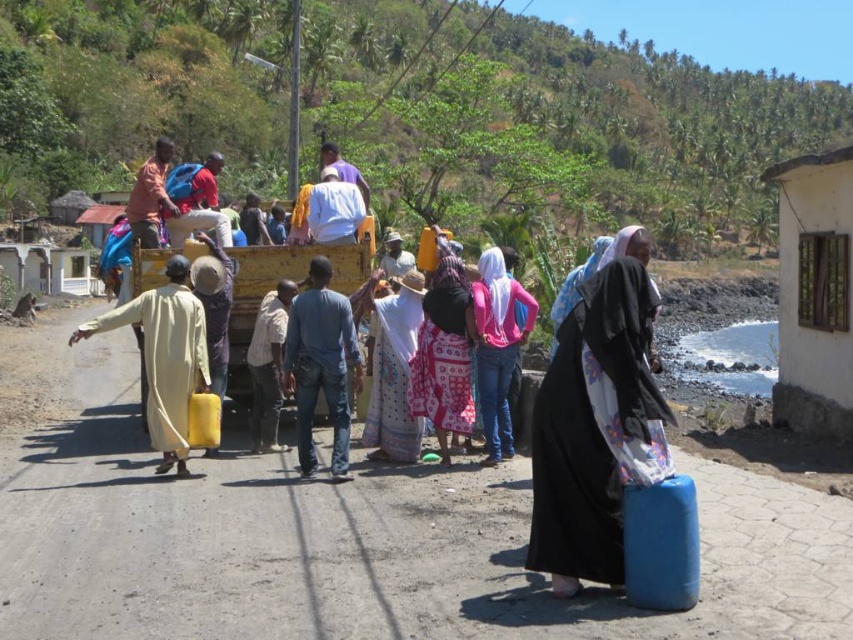
You are standing at point (x=409, y=330) and want to walk to point (x=270, y=264). Is the destination in front of or behind you?

The destination point (x=270, y=264) is behind you since it is located behind point (x=409, y=330) where you are standing.

You are a photographer standing near the yellow truck in the rural scene. You notice the blue fabric bag at lower right and the white printed dress at center. Which object is positioned farther to the east?

The blue fabric bag at lower right is to the right of the white printed dress at center, so it is positioned farther to the east.

You are a photographer standing in front of the yellow truck. You want to take a photo of both the yellow matte wagon at center and the white printed dress at center. Which object should you adjust your camera focus on first to ensure both are in the frame?

You should focus on the yellow matte wagon at center first since it is closer to you than the white printed dress at center, ensuring both are in the frame.